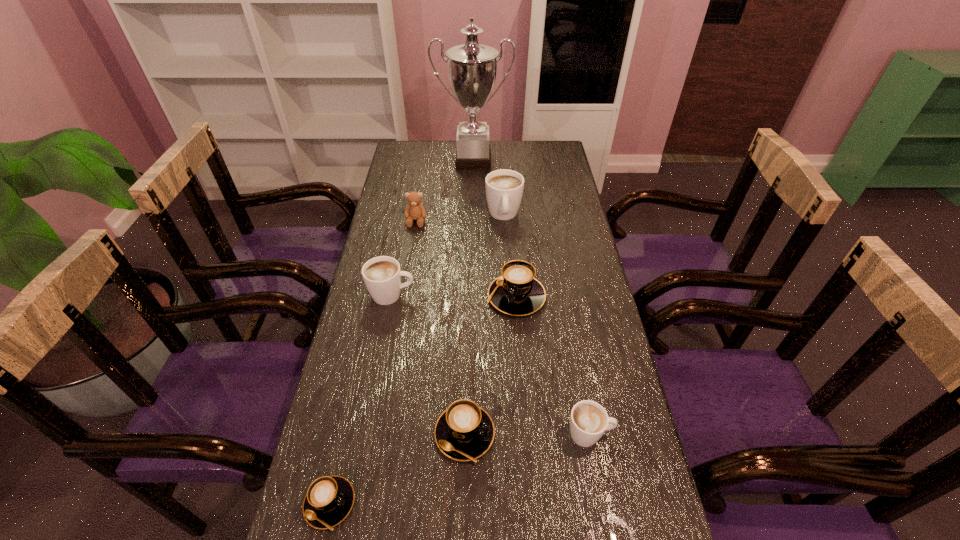
Identify which white cappuccino is located as the second nearest to the leftmost black cappuccino. Please provide its 2D coordinates. Your answer should be formatted as a tuple, i.e. [(x, y)], where the tuple contains the x and y coordinates of a point satisfying the conditions above.

[(382, 275)]

Select which black cappuccino appears as the second closest to the second farthest black cappuccino. Please provide its 2D coordinates. Your answer should be formatted as a tuple, i.e. [(x, y)], where the tuple contains the x and y coordinates of a point satisfying the conditions above.

[(517, 292)]

Locate which black cappuccino is the closest to the second nearest black cappuccino. Please provide its 2D coordinates. Your answer should be formatted as a tuple, i.e. [(x, y)], where the tuple contains the x and y coordinates of a point satisfying the conditions above.

[(329, 499)]

This screenshot has width=960, height=540. In order to click on blank space that satisfies the following two spatial constraints: 1. on the face of the brown teddy bear; 2. on the right side of the biggest black cappuccino in this screenshot , I will do `click(404, 296)`.

I want to click on free point that satisfies the following two spatial constraints: 1. at the front view of the trophy cup; 2. with the handle on the side of the second farthest white cappuccino, so click(x=470, y=295).